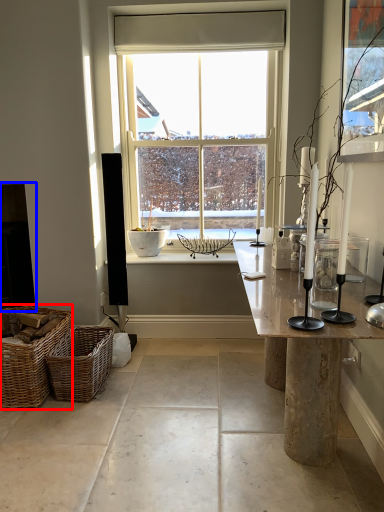
Question: Among these objects, which one is farthest to the camera, picnic basket (highlighted by a red box) or fireplace (highlighted by a blue box)?

Choices:
 (A) picnic basket
 (B) fireplace

Answer: (B)